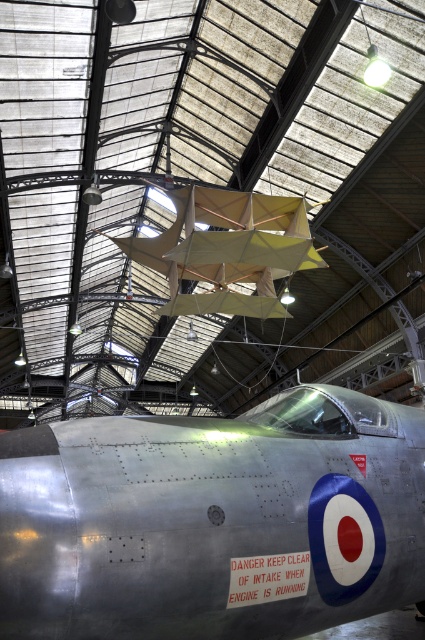
You are standing in the hangar and want to take a photo of the vintage aircraft. You notice two points marked on the aircraft, one at point coordinates point (345,550) and another at point (178,196). Which point will appear larger in your photo?

Point (345,550) is closer to the camera than point (178,196), so it will appear larger in the photo.

You are an aviation enthusiast visiting the museum and notice both the silver metallic airplane at center and the matte yellow paper airplane at center. Which one is wider?

The silver metallic airplane at center has a lesser width compared to the matte yellow paper airplane at center, so the matte yellow paper airplane at center is wider.

You are an aviation enthusiast visiting the museum and notice both the silver metallic airplane at center and the matte yellow paper airplane at center. Which one takes up more space in the hangar?

The matte yellow paper airplane at center takes up more space than the silver metallic airplane at center.